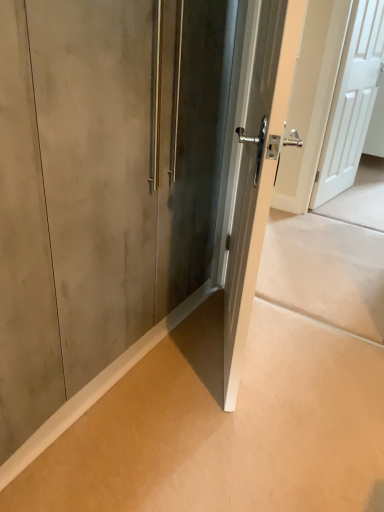
The image size is (384, 512). I want to click on vacant space to the left of satin silver door at center, arranged as the 2th door when viewed from the right, so click(169, 352).